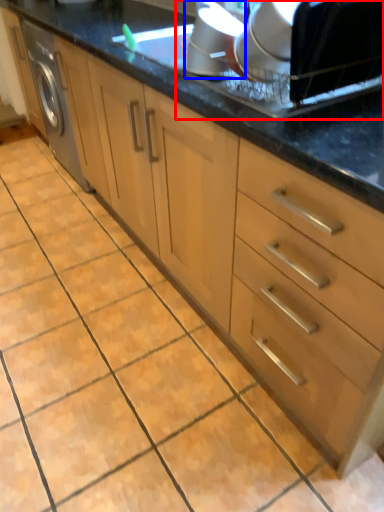
Question: Which object is further to the camera taking this photo, appliance (highlighted by a red box) or appliance (highlighted by a blue box)?

Choices:
 (A) appliance
 (B) appliance

Answer: (B)